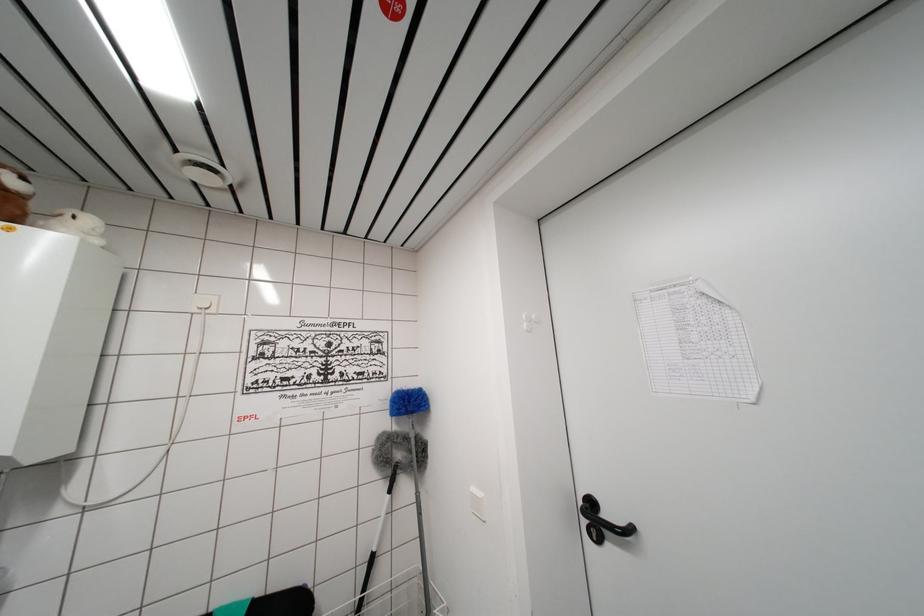
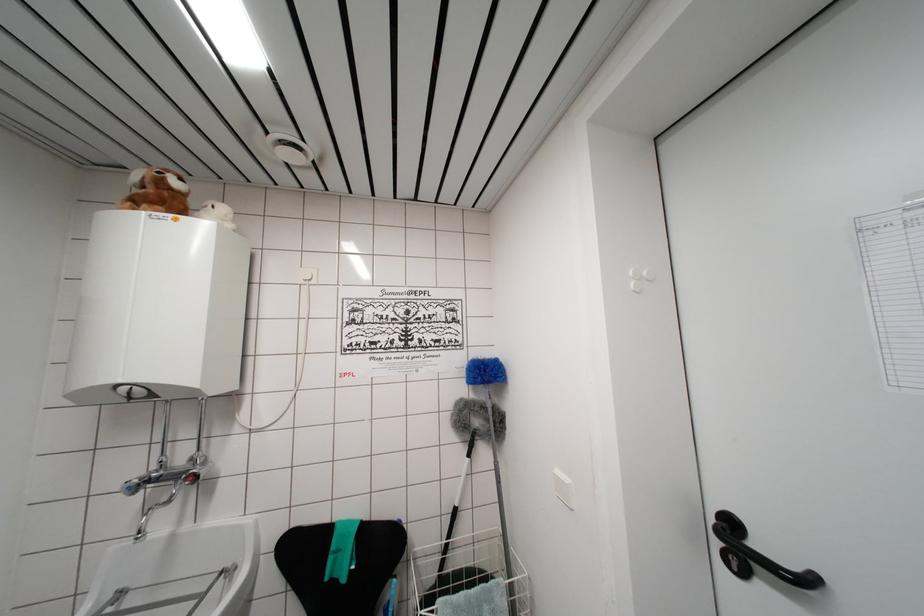
Find the pixel in the second image that matches pixel 409 402 in the first image.

(484, 371)